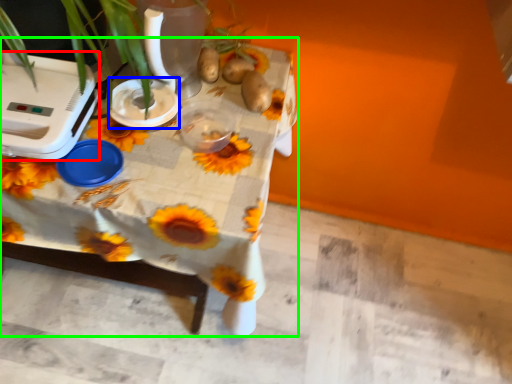
Question: Considering the real-world distances, which object is closest to appliance (highlighted by a red box)? appliance (highlighted by a blue box) or table (highlighted by a green box).

Choices:
 (A) appliance
 (B) table

Answer: (A)